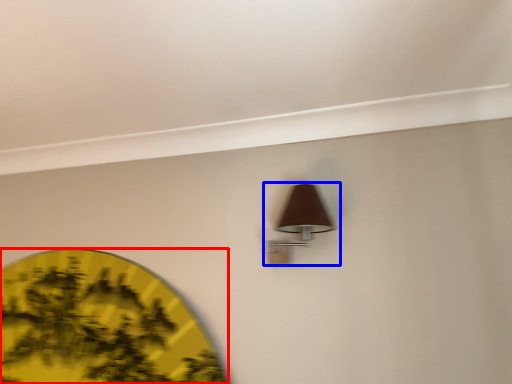
Question: Which of the following is the farthest to the observer, circle (highlighted by a red box) or lamp (highlighted by a blue box)?

Choices:
 (A) circle
 (B) lamp

Answer: (A)